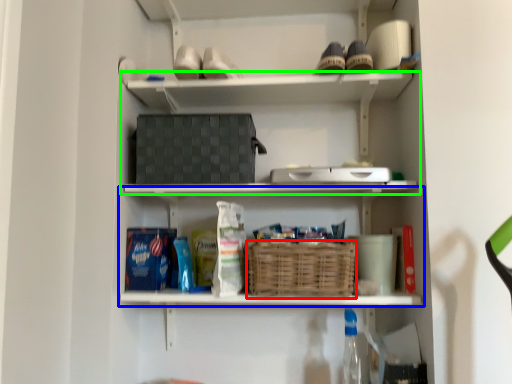
Question: Which is nearer to the basket (highlighted by a red box)? shelf (highlighted by a blue box) or shelf (highlighted by a green box).

Choices:
 (A) shelf
 (B) shelf

Answer: (A)